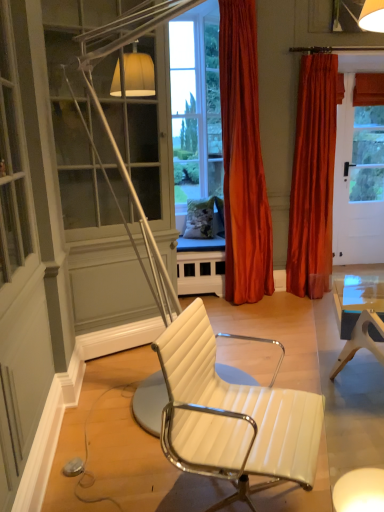
This screenshot has width=384, height=512. In order to click on satin orange curtain at center, positioned as the first curtain in left-to-right order in this screenshot , I will do `click(243, 158)`.

Locate an element on the screen. satin orange curtain at center, arranged as the 2th curtain when viewed from the right is located at coordinates (243, 158).

Considering the sizes of velvet orange curtain at right, which ranks as the 2th curtain in left-to-right order, and white leather chair at center in the image, is velvet orange curtain at right, which ranks as the 2th curtain in left-to-right order, bigger or smaller than white leather chair at center?

Clearly, velvet orange curtain at right, which ranks as the 2th curtain in left-to-right order, is larger in size than white leather chair at center.

Is white leather chair at center at the back of velvet orange curtain at right, the first curtain when ordered from right to left?

That's not correct — velvet orange curtain at right, the first curtain when ordered from right to left, is not looking away from white leather chair at center.

Looking at this image, how distant is velvet orange curtain at right, the first curtain when ordered from right to left, from white leather chair at center?

8.38 feet.

Is white leather chair at center surrounded by velvet orange curtain at right, the first curtain when ordered from right to left?

Definitely not — white leather chair at center is not inside velvet orange curtain at right, the first curtain when ordered from right to left.

Considering the relative sizes of satin orange curtain at center, arranged as the 2th curtain when viewed from the right, and white leather chair at center in the image provided, is satin orange curtain at center, arranged as the 2th curtain when viewed from the right, taller than white leather chair at center?

Answer: Correct, satin orange curtain at center, arranged as the 2th curtain when viewed from the right, is much taller as white leather chair at center.

From the image's perspective, relative to white leather chair at center, is satin orange curtain at center, arranged as the 2th curtain when viewed from the right, above or below?

From the image's perspective, satin orange curtain at center, arranged as the 2th curtain when viewed from the right, appears above white leather chair at center.

Which object is positioned more to the right, satin orange curtain at center, positioned as the first curtain in left-to-right order, or white leather chair at center?

Positioned to the right is satin orange curtain at center, positioned as the first curtain in left-to-right order.

Does satin orange curtain at center, arranged as the 2th curtain when viewed from the right, have a lesser width compared to white leather chair at center?

Yes.

Is satin orange curtain at center, arranged as the 2th curtain when viewed from the right, with velvet orange curtain at right, the first curtain when ordered from right to left?

satin orange curtain at center, arranged as the 2th curtain when viewed from the right, is not next to velvet orange curtain at right, the first curtain when ordered from right to left, and they're not touching.

Which is more to the left, satin orange curtain at center, arranged as the 2th curtain when viewed from the right, or velvet orange curtain at right, which ranks as the 2th curtain in left-to-right order?

satin orange curtain at center, arranged as the 2th curtain when viewed from the right.

From a real-world perspective, which is physically above, satin orange curtain at center, positioned as the first curtain in left-to-right order, or velvet orange curtain at right, which ranks as the 2th curtain in left-to-right order?

From a 3D spatial view, satin orange curtain at center, positioned as the first curtain in left-to-right order, is above.

Is the position of satin orange curtain at center, arranged as the 2th curtain when viewed from the right, more distant than that of velvet orange curtain at right, the first curtain when ordered from right to left?

No, satin orange curtain at center, arranged as the 2th curtain when viewed from the right, is closer to the camera.

Which object is closer to the camera, white leather chair at center or velvet orange curtain at right, the first curtain when ordered from right to left?

white leather chair at center.

From the image's perspective, relative to velvet orange curtain at right, the first curtain when ordered from right to left, is white leather chair at center above or below?

From the image's perspective, white leather chair at center appears below velvet orange curtain at right, the first curtain when ordered from right to left.

Does white leather chair at center have a greater width compared to velvet orange curtain at right, the first curtain when ordered from right to left?

Yes, white leather chair at center is wider than velvet orange curtain at right, the first curtain when ordered from right to left.

Based on the photo, from a real-world perspective, is white leather chair at center located beneath velvet orange curtain at right, the first curtain when ordered from right to left?

Yes.

Is velvet orange curtain at right, which ranks as the 2th curtain in left-to-right order, bigger or smaller than satin orange curtain at center, positioned as the first curtain in left-to-right order?

Clearly, velvet orange curtain at right, which ranks as the 2th curtain in left-to-right order, is smaller in size than satin orange curtain at center, positioned as the first curtain in left-to-right order.

The width and height of the screenshot is (384, 512). What are the coordinates of `curtain behind the satin orange curtain at center, arranged as the 2th curtain when viewed from the right` in the screenshot? It's located at (313, 178).

From the image's perspective, who appears lower, velvet orange curtain at right, the first curtain when ordered from right to left, or satin orange curtain at center, arranged as the 2th curtain when viewed from the right?

velvet orange curtain at right, the first curtain when ordered from right to left, appears lower in the image.

Considering the positions of objects velvet orange curtain at right, which ranks as the 2th curtain in left-to-right order, and satin orange curtain at center, positioned as the first curtain in left-to-right order, in the image provided, who is behind, velvet orange curtain at right, which ranks as the 2th curtain in left-to-right order, or satin orange curtain at center, positioned as the first curtain in left-to-right order,?

velvet orange curtain at right, which ranks as the 2th curtain in left-to-right order, is behind.

Is white leather chair at center not within satin orange curtain at center, arranged as the 2th curtain when viewed from the right?

white leather chair at center lies outside satin orange curtain at center, arranged as the 2th curtain when viewed from the right,'s area.

Can you confirm if white leather chair at center is wider than satin orange curtain at center, arranged as the 2th curtain when viewed from the right?

Indeed, white leather chair at center has a greater width compared to satin orange curtain at center, arranged as the 2th curtain when viewed from the right.

Considering the points (185, 323) and (248, 230), which point is in front, point (185, 323) or point (248, 230)?

The point (185, 323) is in front.

How different are the orientations of white leather chair at center and satin orange curtain at center, positioned as the first curtain in left-to-right order, in degrees?

The facing directions of white leather chair at center and satin orange curtain at center, positioned as the first curtain in left-to-right order, are 64.5 degrees apart.

Identify the location of chair on the left of velvet orange curtain at right, the first curtain when ordered from right to left. This screenshot has width=384, height=512. (232, 416).

Starting from the white leather chair at center, which curtain is the 1st one to the right? Please provide its 2D coordinates.

[(243, 158)]

From the image, which object appears to be farther from white leather chair at center, velvet orange curtain at right, which ranks as the 2th curtain in left-to-right order, or satin orange curtain at center, positioned as the first curtain in left-to-right order?

velvet orange curtain at right, which ranks as the 2th curtain in left-to-right order, lies further to white leather chair at center than the other object.

Looking at the image, which one is located closer to velvet orange curtain at right, which ranks as the 2th curtain in left-to-right order, white leather chair at center or satin orange curtain at center, arranged as the 2th curtain when viewed from the right?

satin orange curtain at center, arranged as the 2th curtain when viewed from the right.

Considering their positions, is velvet orange curtain at right, the first curtain when ordered from right to left, positioned closer to satin orange curtain at center, arranged as the 2th curtain when viewed from the right, than white leather chair at center?

velvet orange curtain at right, the first curtain when ordered from right to left.

Looking at this image, from the image, which object appears to be farther from velvet orange curtain at right, the first curtain when ordered from right to left, satin orange curtain at center, arranged as the 2th curtain when viewed from the right, or white leather chair at center?

Among the two, white leather chair at center is located further to velvet orange curtain at right, the first curtain when ordered from right to left.

Looking at the image, which one is located further to satin orange curtain at center, positioned as the first curtain in left-to-right order, white leather chair at center or velvet orange curtain at right, which ranks as the 2th curtain in left-to-right order?

white leather chair at center is positioned further to the anchor satin orange curtain at center, positioned as the first curtain in left-to-right order.

Estimate the real-world distances between objects in this image. Which object is closer to white leather chair at center, satin orange curtain at center, arranged as the 2th curtain when viewed from the right, or velvet orange curtain at right, the first curtain when ordered from right to left?

Among the two, satin orange curtain at center, arranged as the 2th curtain when viewed from the right, is located nearer to white leather chair at center.

Where is `curtain positioned between white leather chair at center and velvet orange curtain at right, which ranks as the 2th curtain in left-to-right order, from near to far`? The image size is (384, 512). curtain positioned between white leather chair at center and velvet orange curtain at right, which ranks as the 2th curtain in left-to-right order, from near to far is located at coordinates (243, 158).